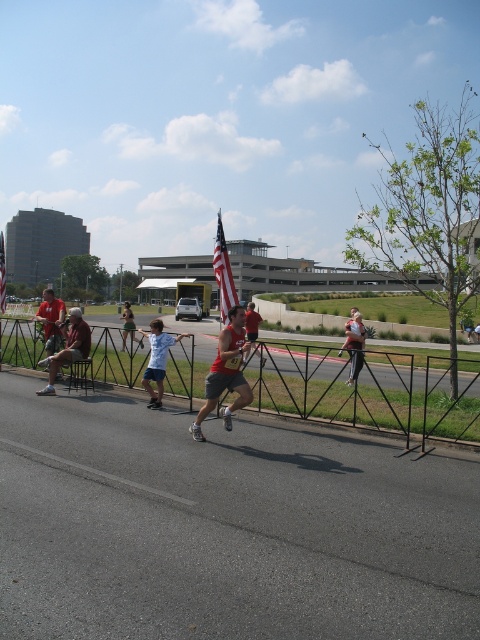
Is black metal fence at center wider than american flag at center?

Indeed, black metal fence at center has a greater width compared to american flag at center.

This screenshot has height=640, width=480. What do you see at coordinates (370, 392) in the screenshot?
I see `black metal fence at center` at bounding box center [370, 392].

Looking at this image, who is more distant from viewer, (180, 360) or (223, 317)?

Point (180, 360)

Image resolution: width=480 pixels, height=640 pixels. In order to click on black metal fence at center in this screenshot , I will do `click(370, 392)`.

Does matte gray shorts at left appear on the right side of matte red shirt at left?

Correct, you'll find matte gray shorts at left to the right of matte red shirt at left.

Which is behind, point (82, 317) or point (48, 333)?

Positioned behind is point (48, 333).

The height and width of the screenshot is (640, 480). Describe the element at coordinates (68, 348) in the screenshot. I see `matte gray shorts at left` at that location.

The height and width of the screenshot is (640, 480). Identify the location of matte gray shorts at left. (68, 348).

Who is lower down, light blue t-shirt at center or matte red shirt at left?

light blue t-shirt at center is below.

The image size is (480, 640). Identify the location of light blue t-shirt at center. (157, 358).

Is point (153, 358) more distant than point (46, 332)?

No.

You are a GUI agent. You are given a task and a screenshot of the screen. Output one action in this format:
    pyautogui.click(x=<x>, y=<y>)
    Task: Click on the light blue t-shirt at center
    
    Given the screenshot: What is the action you would take?
    pyautogui.click(x=157, y=358)